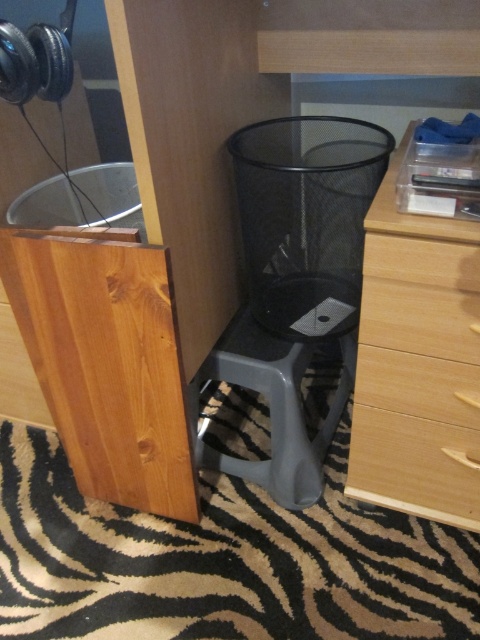
Question: Is gray plastic stool at center closer to camera compared to wooden drawer at lower right?

Choices:
 (A) no
 (B) yes

Answer: (A)

Question: Is wooden dresser at center below light brown wood drawer at lower right?

Choices:
 (A) yes
 (B) no

Answer: (B)

Question: Which point is closer to the camera taking this photo?

Choices:
 (A) (362, 394)
 (B) (379, 419)
 (C) (431, 481)
 (D) (193, 408)

Answer: (A)

Question: Is wooden dresser at center wider than gray plastic stool at center?

Choices:
 (A) yes
 (B) no

Answer: (B)

Question: Among these points, which one is farthest from the camera?

Choices:
 (A) (476, 435)
 (B) (404, 397)

Answer: (B)

Question: Which object is the closest to the light brown wood drawer at lower right?

Choices:
 (A) wooden drawer at lower right
 (B) wooden dresser at center
 (C) gray plastic stool at center

Answer: (B)